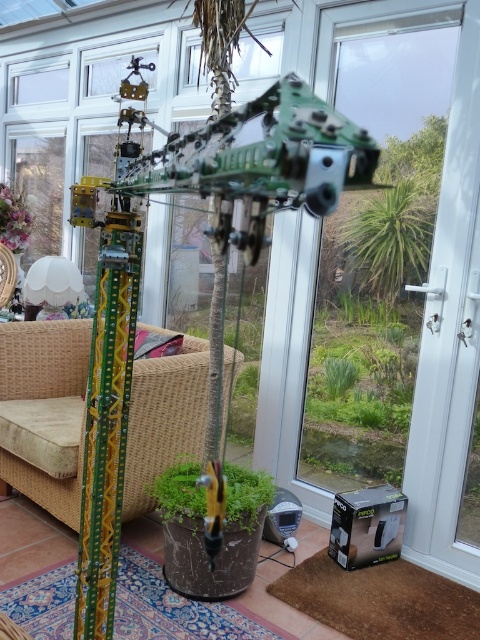
Is wicker armchair at lower left closer to the viewer compared to white fabric lampshade at lower left?

Yes, it is in front of white fabric lampshade at lower left.

Which is more to the right, wicker armchair at lower left or white fabric lampshade at lower left?

wicker armchair at lower left

Who is more distant from viewer, (78, 524) or (55, 266)?

The point (55, 266) is more distant.

Locate an element on the screen. Image resolution: width=480 pixels, height=640 pixels. wicker armchair at lower left is located at coordinates [x=44, y=412].